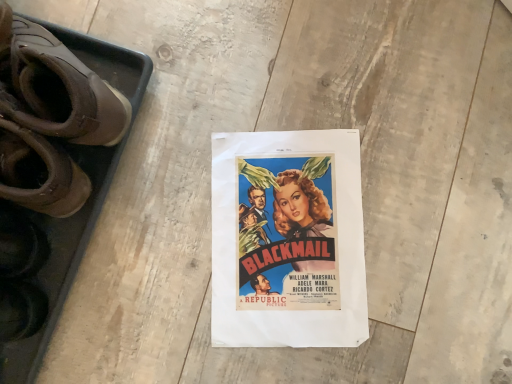
The width and height of the screenshot is (512, 384). In order to click on empty space that is ontop of vivid paper poster at center (from a real-world perspective) in this screenshot , I will do `click(290, 241)`.